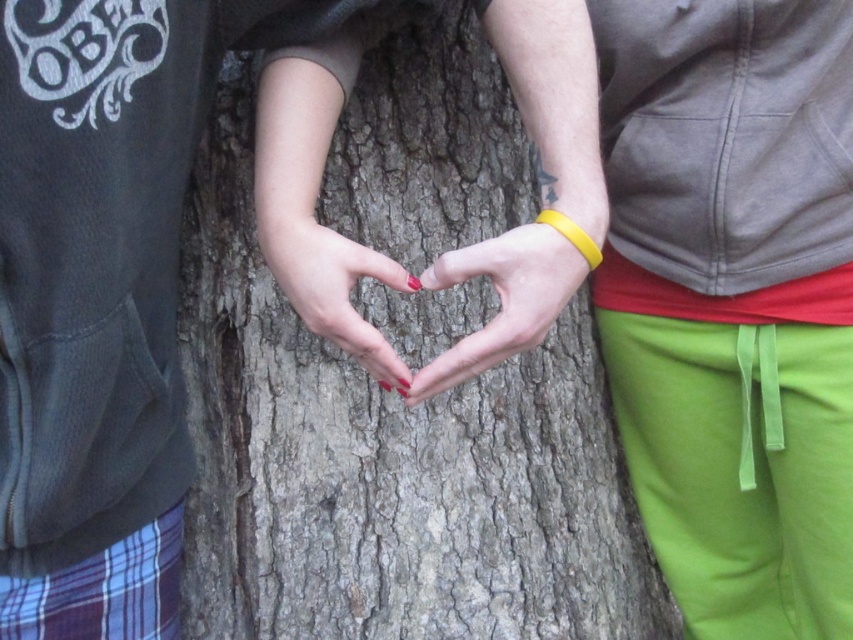
Question: Can you confirm if smooth bark tree trunk at center is positioned to the right of nail polish at center?

Choices:
 (A) no
 (B) yes

Answer: (B)

Question: From the image, what is the correct spatial relationship of smooth bark tree trunk at center in relation to smooth skin heart at center?

Choices:
 (A) left
 (B) right

Answer: (A)

Question: Can you confirm if smooth bark tree trunk at center is positioned to the right of nail polish at center?

Choices:
 (A) yes
 (B) no

Answer: (A)

Question: Which is farther from the smooth bark tree trunk at center?

Choices:
 (A) smooth skin heart at center
 (B) nail polish at center

Answer: (A)

Question: Which object is the farthest from the smooth bark tree trunk at center?

Choices:
 (A) smooth skin heart at center
 (B) nail polish at center

Answer: (A)

Question: Estimate the real-world distances between objects in this image. Which object is closer to the smooth bark tree trunk at center?

Choices:
 (A) nail polish at center
 (B) smooth skin heart at center

Answer: (A)